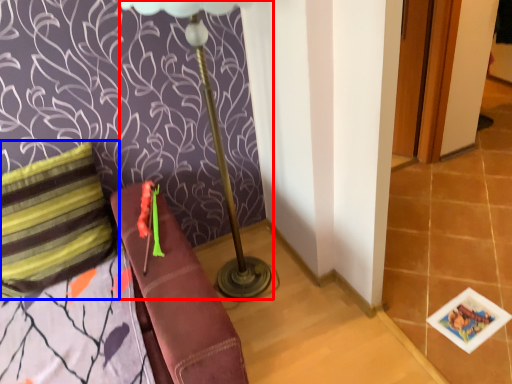
Question: Which of the following is the farthest to the observer, table lamp (highlighted by a red box) or pillow (highlighted by a blue box)?

Choices:
 (A) table lamp
 (B) pillow

Answer: (B)